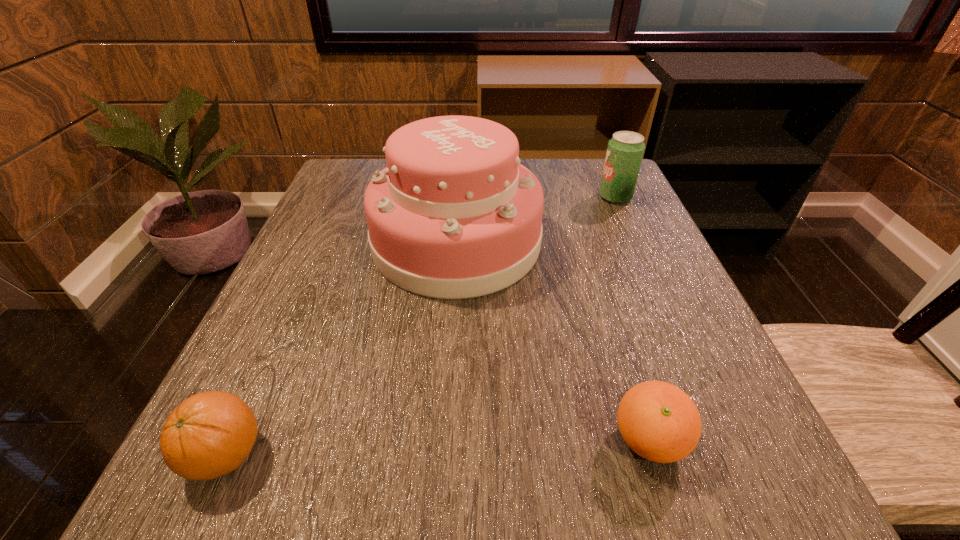
Locate an element on the screen. vacant region between the right orange and the leftmost object is located at coordinates (437, 448).

Identify the location of free spot between the birthday cake and the left orange. (341, 348).

You are a GUI agent. You are given a task and a screenshot of the screen. Output one action in this format:
    pyautogui.click(x=<x>, y=<y>)
    Task: Click on the vacant space that is in between the rightmost object and the right orange
    
    Given the screenshot: What is the action you would take?
    pyautogui.click(x=632, y=319)

Locate an element on the screen. The image size is (960, 540). vacant area that lies between the right orange and the leftmost object is located at coordinates (437, 448).

Find the location of a particular element. This screenshot has height=540, width=960. object that is the second closest to the birthday cake is located at coordinates (658, 421).

Where is `object that is the closest to the right orange`? This screenshot has height=540, width=960. object that is the closest to the right orange is located at coordinates (454, 215).

Where is `blank area in the image that satisfies the following two spatial constraints: 1. on the back side of the left orange; 2. on the right side of the second object from left to right`? This screenshot has width=960, height=540. blank area in the image that satisfies the following two spatial constraints: 1. on the back side of the left orange; 2. on the right side of the second object from left to right is located at coordinates [x=322, y=242].

This screenshot has height=540, width=960. In order to click on vacant space that satisfies the following two spatial constraints: 1. on the back side of the right orange; 2. on the left side of the leftmost object in this screenshot , I will do `click(231, 440)`.

Find the location of a particular element. Image resolution: width=960 pixels, height=540 pixels. free spot that satisfies the following two spatial constraints: 1. on the front side of the third object from right to left; 2. on the right side of the right orange is located at coordinates (443, 440).